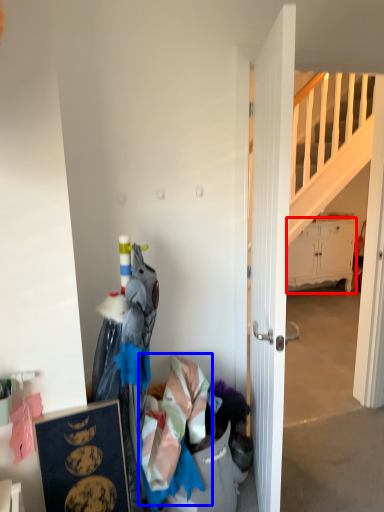
Question: Which point is closer to the camera, cabinetry (highlighted by a red box) or clothing (highlighted by a blue box)?

Choices:
 (A) cabinetry
 (B) clothing

Answer: (B)